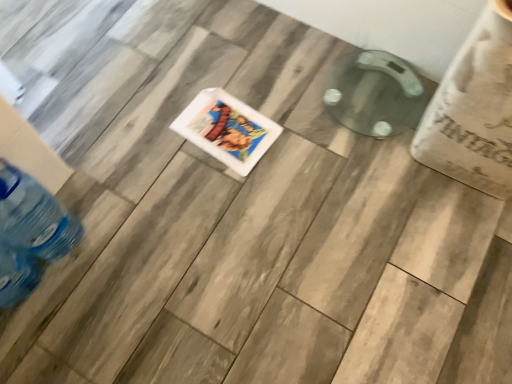
Find the location of a particular element. vacant space in white glossy comic book at center (from a real-world perspective) is located at coordinates (227, 132).